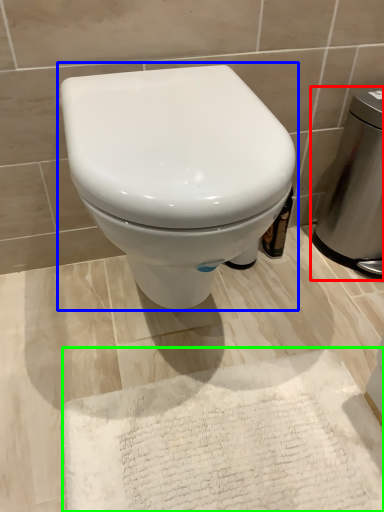
Question: Estimate the real-world distances between objects in this image. Which object is farther from appliance (highlighted by a red box), toilet (highlighted by a blue box) or bath mat (highlighted by a green box)?

Choices:
 (A) toilet
 (B) bath mat

Answer: (B)